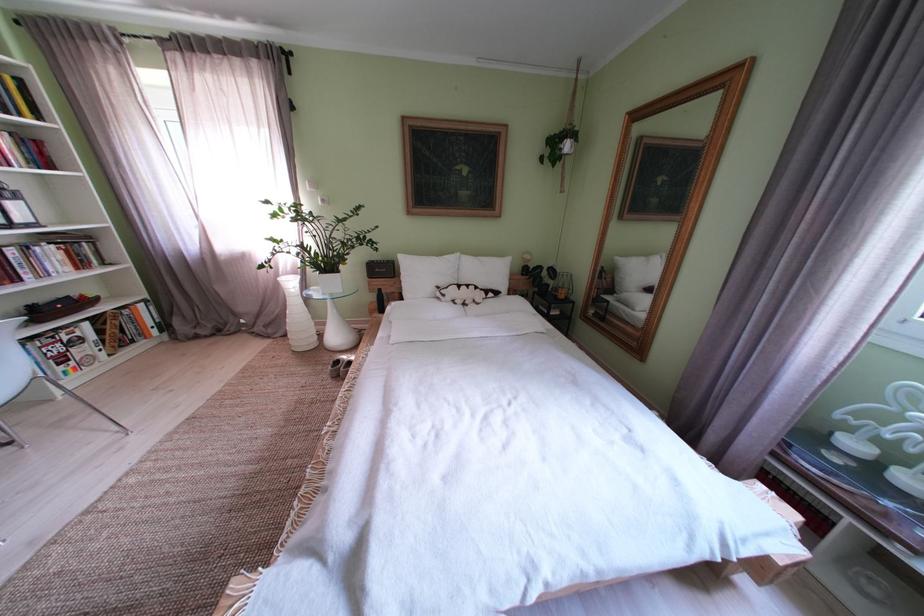
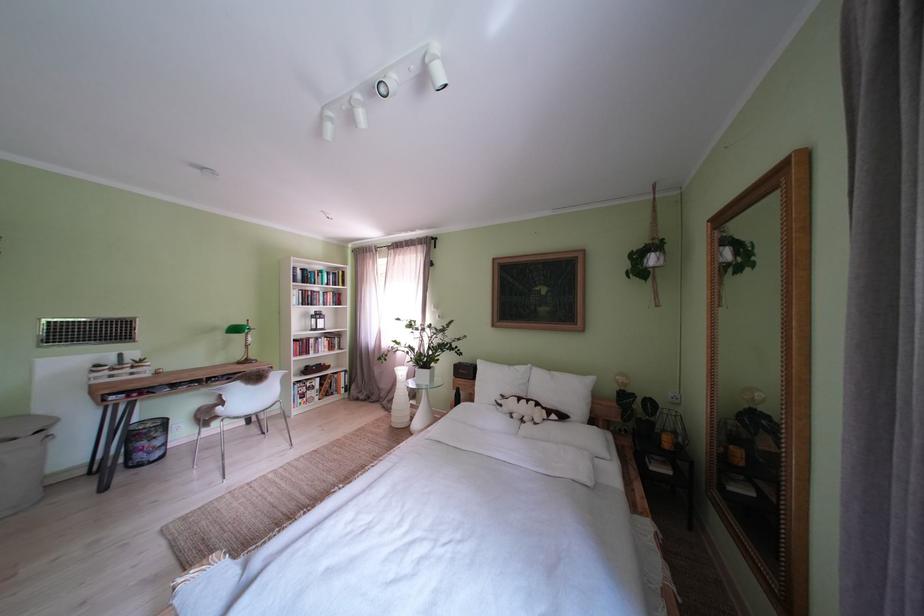
Find the pixel in the second image that matches pixel 455 301 in the first image.

(512, 411)